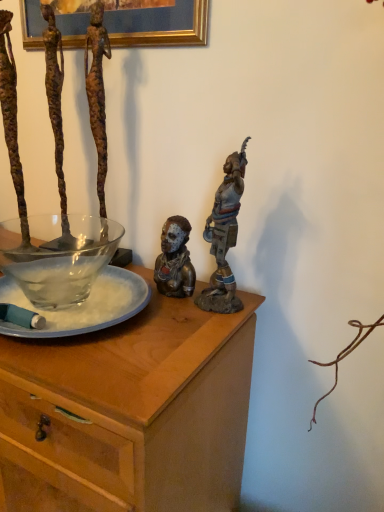
Question: Does rusty metal figure at upper left, placed as the third person when sorted from right to left, have a lesser height compared to bronze statue at center, the 2th person in the right-to-left sequence?

Choices:
 (A) yes
 (B) no

Answer: (B)

Question: Does rusty metal figure at upper left, placed as the third person when sorted from right to left, have a greater width compared to bronze statue at center, placed as the 2th person when sorted from left to right?

Choices:
 (A) no
 (B) yes

Answer: (A)

Question: From the image's perspective, is rusty metal figure at upper left, placed as the third person when sorted from right to left, on bronze statue at center, placed as the 2th person when sorted from left to right?

Choices:
 (A) no
 (B) yes

Answer: (B)

Question: From a real-world perspective, is rusty metal figure at upper left, acting as the first person starting from the left, on top of bronze statue at center, the 2th person in the right-to-left sequence?

Choices:
 (A) no
 (B) yes

Answer: (B)

Question: Is rusty metal figure at upper left, placed as the third person when sorted from right to left, at the left side of bronze statue at center, the 2th person in the right-to-left sequence?

Choices:
 (A) no
 (B) yes

Answer: (B)

Question: Based on their positions, is rusty metal figure at upper left, placed as the third person when sorted from right to left, located to the left or right of transparent glass bowl at left?

Choices:
 (A) right
 (B) left

Answer: (A)

Question: From the image's perspective, relative to transparent glass bowl at left, is rusty metal figure at upper left, placed as the third person when sorted from right to left, above or below?

Choices:
 (A) below
 (B) above

Answer: (B)

Question: Considering the positions of rusty metal figure at upper left, placed as the third person when sorted from right to left, and transparent glass bowl at left in the image, is rusty metal figure at upper left, placed as the third person when sorted from right to left, wider or thinner than transparent glass bowl at left?

Choices:
 (A) wide
 (B) thin

Answer: (B)

Question: From their relative heights in the image, would you say rusty metal figure at upper left, acting as the first person starting from the left, is taller or shorter than transparent glass bowl at left?

Choices:
 (A) short
 (B) tall

Answer: (B)

Question: Is point (4, 500) closer or farther from the camera than point (96, 119)?

Choices:
 (A) closer
 (B) farther

Answer: (A)

Question: From the image's perspective, relative to rusty metal figure at upper left, placed as the third person when sorted from right to left, is wooden desk at center above or below?

Choices:
 (A) above
 (B) below

Answer: (B)

Question: Relative to rusty metal figure at upper left, acting as the first person starting from the left, is wooden desk at center in front or behind?

Choices:
 (A) behind
 (B) front

Answer: (B)

Question: Looking at their shapes, would you say wooden desk at center is wider or thinner than rusty metal figure at upper left, placed as the third person when sorted from right to left?

Choices:
 (A) thin
 (B) wide

Answer: (B)

Question: Considering the positions of bronze statue at upper right, which is counted as the 3th person, starting from the left, and rusty metal figure at upper left, placed as the third person when sorted from right to left, in the image, is bronze statue at upper right, which is counted as the 3th person, starting from the left, taller or shorter than rusty metal figure at upper left, placed as the third person when sorted from right to left,?

Choices:
 (A) short
 (B) tall

Answer: (A)

Question: Do you think bronze statue at upper right, the first person in the right-to-left sequence, is within rusty metal figure at upper left, placed as the third person when sorted from right to left, or outside of it?

Choices:
 (A) inside
 (B) outside

Answer: (B)